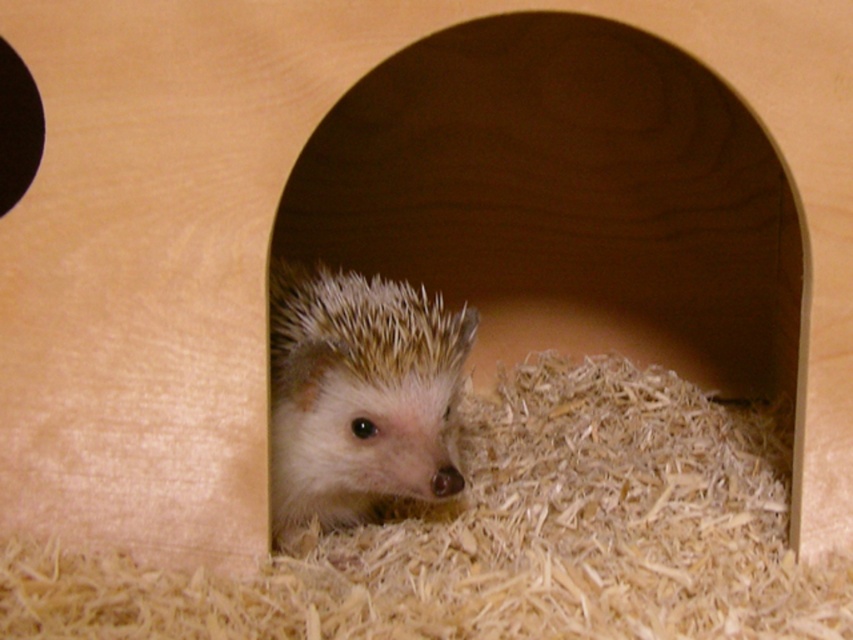
Question: Can you confirm if light brown shredded wood at center is smaller than white spiny hedgehog at center?

Choices:
 (A) no
 (B) yes

Answer: (A)

Question: Which of the following is the closest to the observer?

Choices:
 (A) white spiny hedgehog at center
 (B) black matte hole at upper left

Answer: (A)

Question: Among these points, which one is farthest from the camera?

Choices:
 (A) (22, 90)
 (B) (537, 616)
 (C) (387, 444)

Answer: (A)

Question: Can you confirm if light brown shredded wood at center is positioned below black matte hole at upper left?

Choices:
 (A) yes
 (B) no

Answer: (A)

Question: Estimate the real-world distances between objects in this image. Which object is closer to the white spiny hedgehog at center?

Choices:
 (A) light brown shredded wood at center
 (B) black matte hole at upper left

Answer: (A)

Question: Is white spiny hedgehog at center below black matte hole at upper left?

Choices:
 (A) no
 (B) yes

Answer: (B)